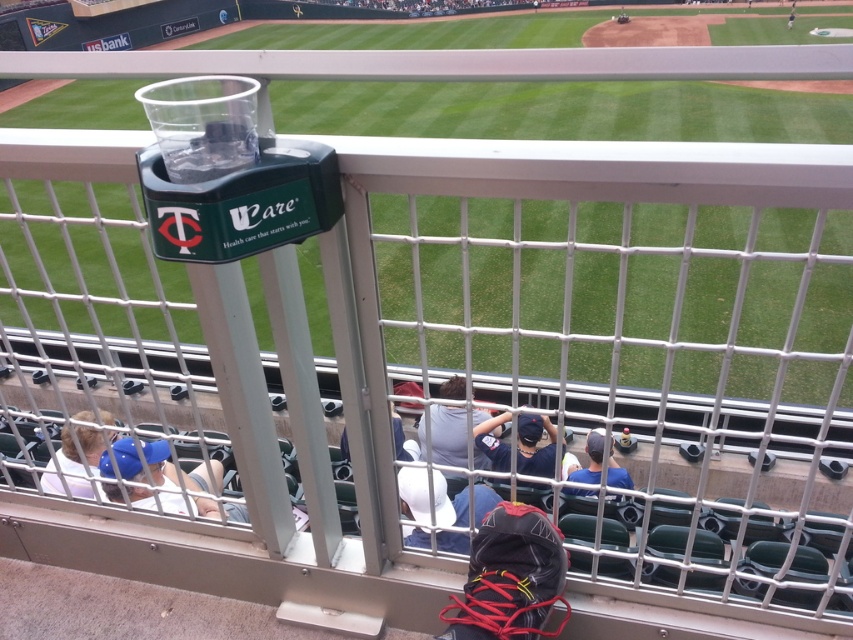
You are a spectator at the baseball stadium and you want to place your black fabric backpack at lower center and dark blue baseball cap at center on the stadium seat. Which object will take up more space on the seat?

The dark blue baseball cap at center takes up more space than the black fabric backpack at lower center because the black fabric backpack at lower center occupies less space than dark blue baseball cap at center.

You are a spectator at the baseball stadium and want to know which of the two caps takes up more space. You see the white matte baseball cap at center and the white fabric cap at lower left. Which one is larger in size?

The white fabric cap at lower left is larger in size because the white matte baseball cap at center occupies less space than it.